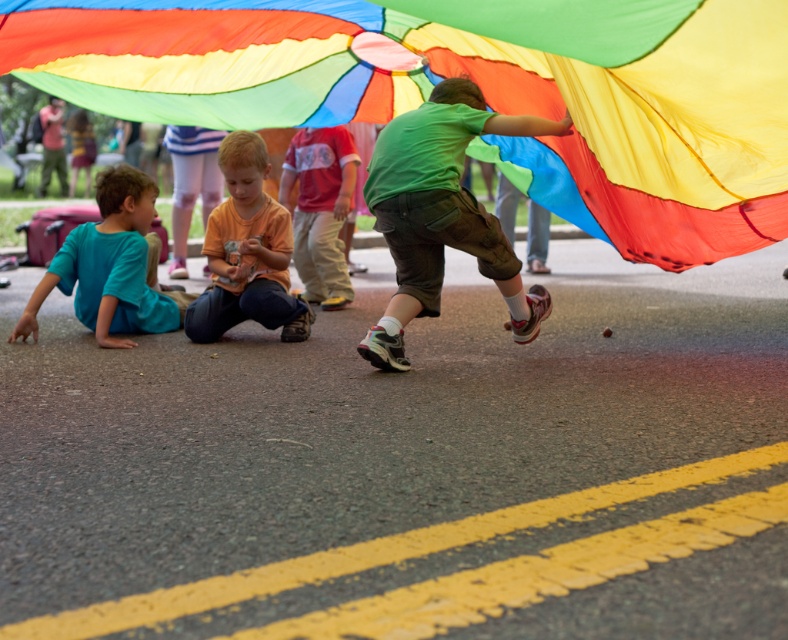
You are a photographer trying to capture a photo of the green matte shorts at center and the matte blue shirt at lower left. Based on their positions, which object is located to the right side of the other?

The green matte shorts at center is to the right of the matte blue shirt at lower left.

You are a photographer trying to capture a photo of the green matte shorts at center. You need to ensure that the rainbow fabric parachute at upper center does not block the view. Based on the scene description, can you determine if the parachute will block the shorts?

The rainbow fabric parachute at upper center might be wider than green matte shorts at center, so there is a possibility that the parachute could block the view of the shorts depending on its exact dimensions and positioning.